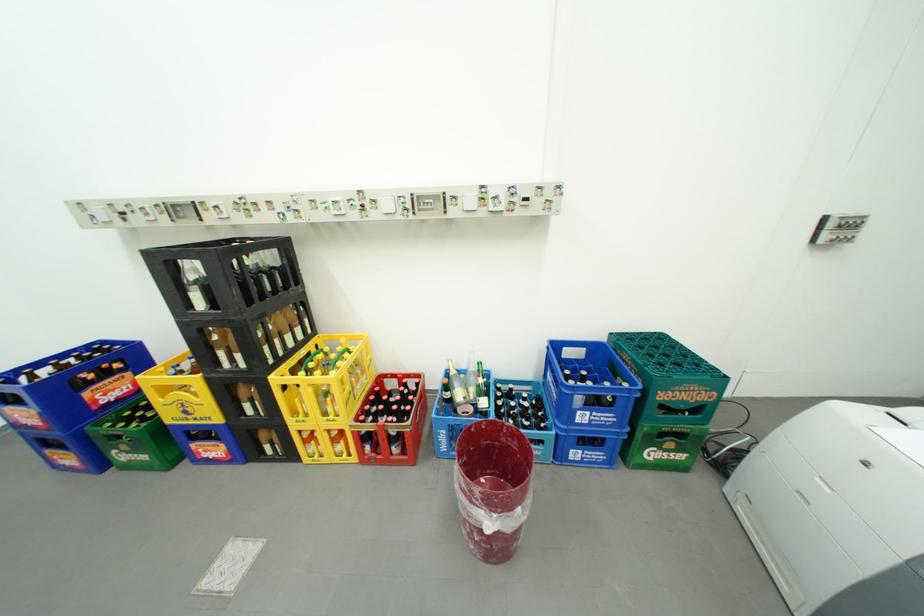
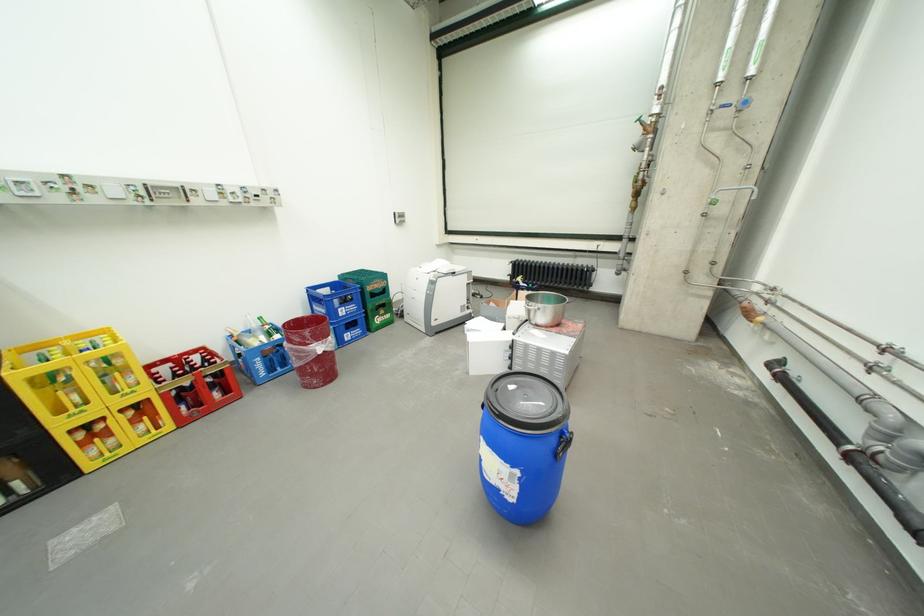
Find the pixel in the second image that matches (x=696, y=392) in the first image.

(386, 285)